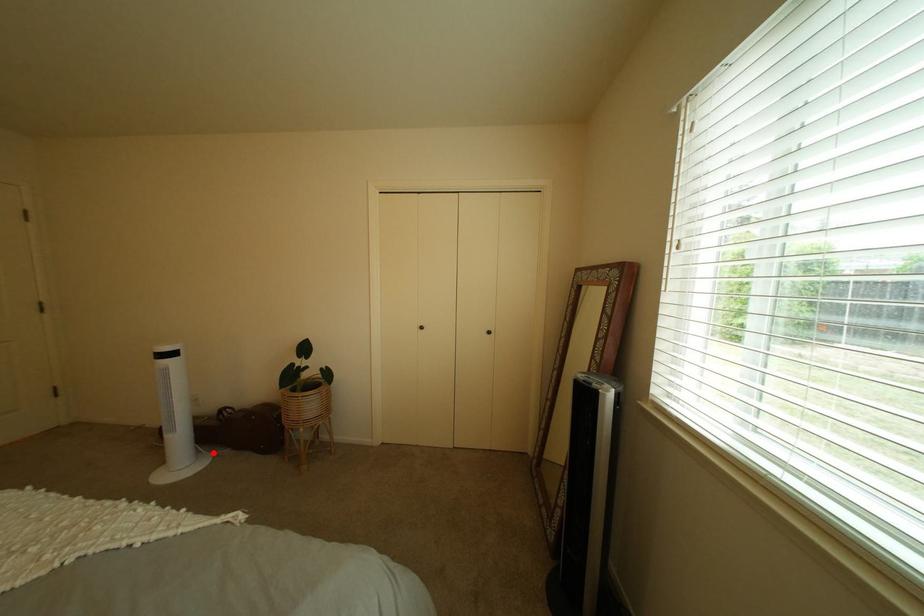
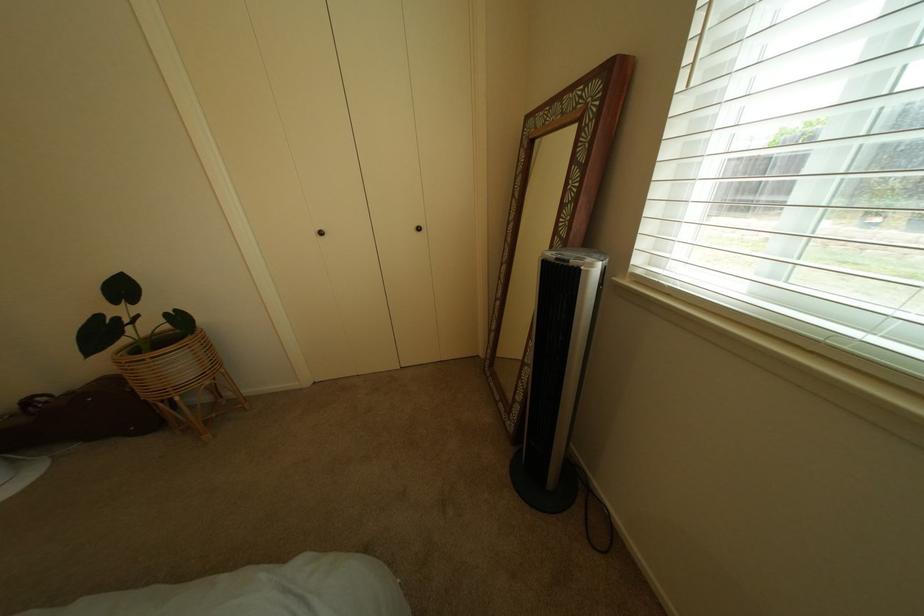
Question: I am providing you with two images of the same scene from different viewpoints. A red point is shown in image1. For the corresponding object point in image2, is it positioned nearer or farther from the camera?

Choices:
 (A) Nearer
 (B) Farther

Answer: (B)